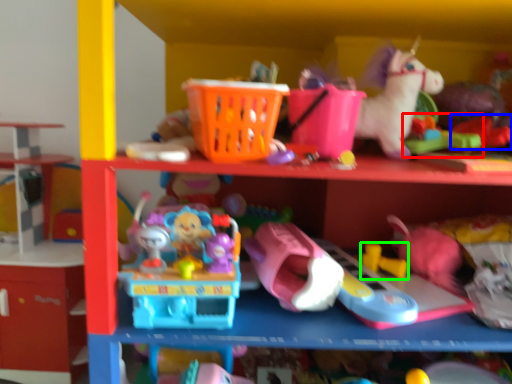
Question: Which object is the closest to the toy (highlighted by a red box)? Choose among these: toy (highlighted by a blue box) or toy (highlighted by a green box).

Choices:
 (A) toy
 (B) toy

Answer: (A)